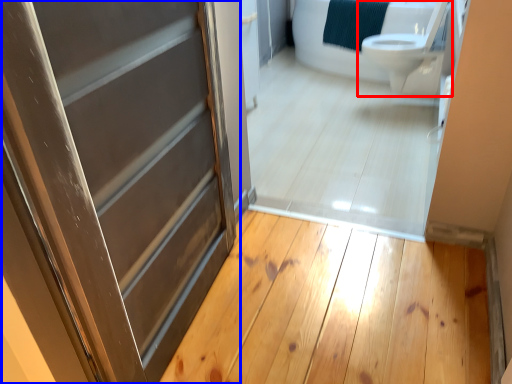
Question: Which object appears closest to the camera in this image, toilet (highlighted by a red box) or door (highlighted by a blue box)?

Choices:
 (A) toilet
 (B) door

Answer: (B)